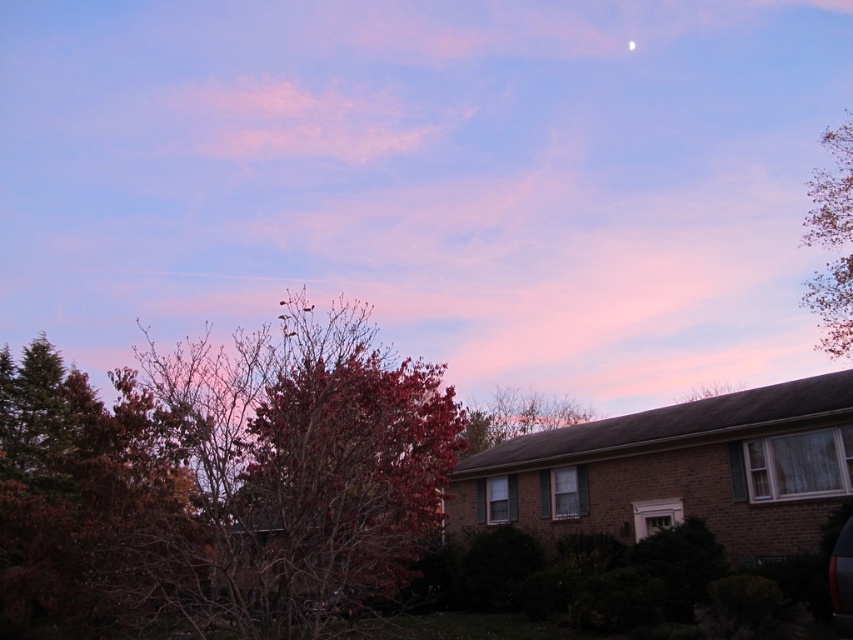
You are standing in the suburban scene and want to reach the pink cotton candy cloud at upper center. Can you walk to it?

The pink cotton candy cloud at upper center is 237.70 feet away from camera, so yes, you can walk to it as it is within a reasonable walking distance.

You are an artist sketching the suburban scene. You want to ensure the pink cotton candy cloud at upper center and the green leafy tree at upper right are proportionally accurate. Which object should you draw wider in your sketch?

The pink cotton candy cloud at upper center should be drawn wider than the green leafy tree at upper right because its width surpasses the tree.